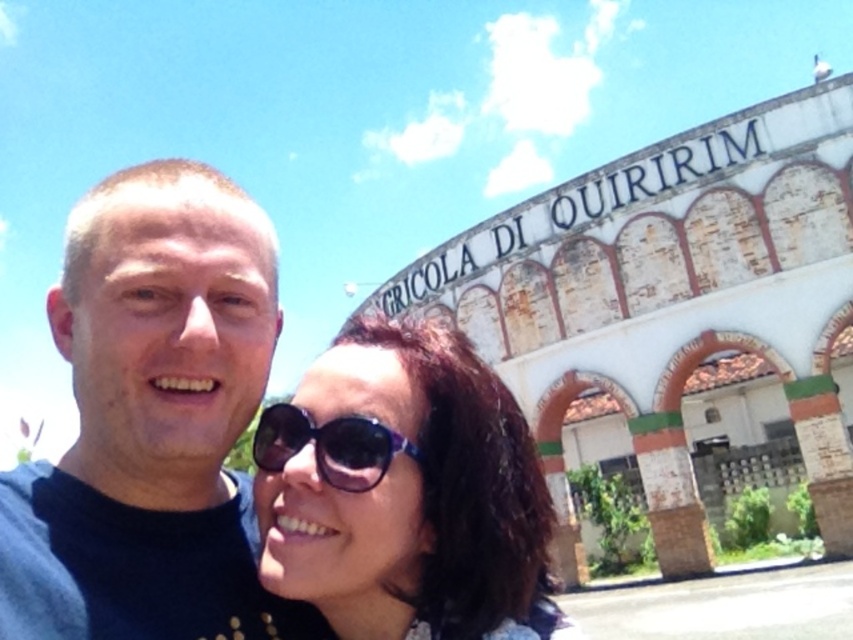
Question: Which of the following is the closest to the observer?

Choices:
 (A) (349, 492)
 (B) (317, 438)

Answer: (A)

Question: Does black matte shirt at center appear over sunglasses at center?

Choices:
 (A) yes
 (B) no

Answer: (B)

Question: Which point is farther to the camera?

Choices:
 (A) transparent plastic sunglasses at center
 (B) black matte shirt at center
 (C) sunglasses at center

Answer: (A)

Question: Where is black matte shirt at center located in relation to sunglasses at center in the image?

Choices:
 (A) right
 (B) left

Answer: (B)

Question: Which of the following is the closest to the observer?

Choices:
 (A) (376, 605)
 (B) (372, 460)
 (C) (196, 172)

Answer: (A)

Question: Does black matte shirt at center appear on the left side of sunglasses at center?

Choices:
 (A) no
 (B) yes

Answer: (B)